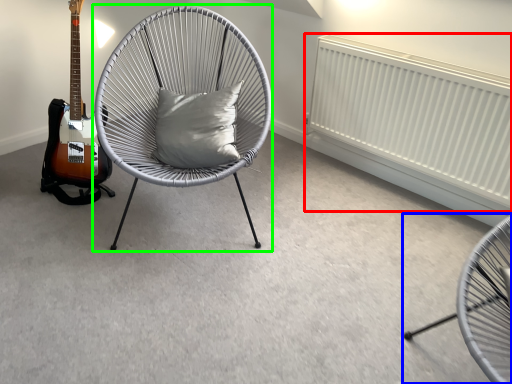
Question: Based on their relative distances, which object is farther from radiator (highlighted by a red box)? Choose from chair (highlighted by a blue box) and chair (highlighted by a green box).

Choices:
 (A) chair
 (B) chair

Answer: (A)